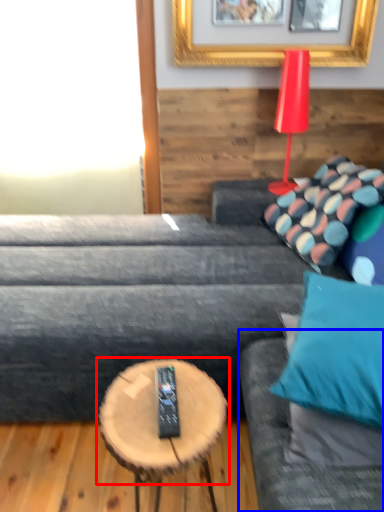
Question: Which object appears farthest to the camera in this image, coffee table (highlighted by a red box) or couch (highlighted by a blue box)?

Choices:
 (A) coffee table
 (B) couch

Answer: (A)